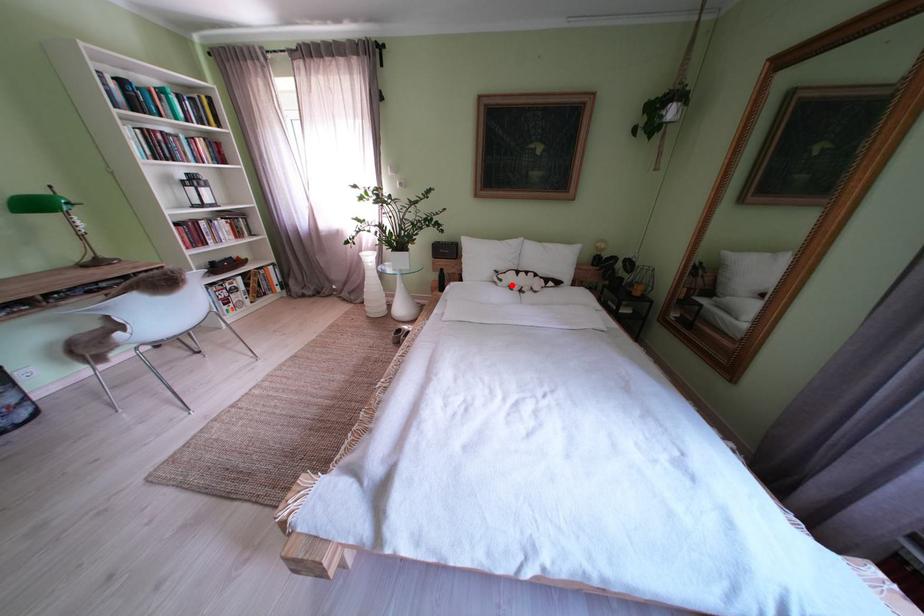
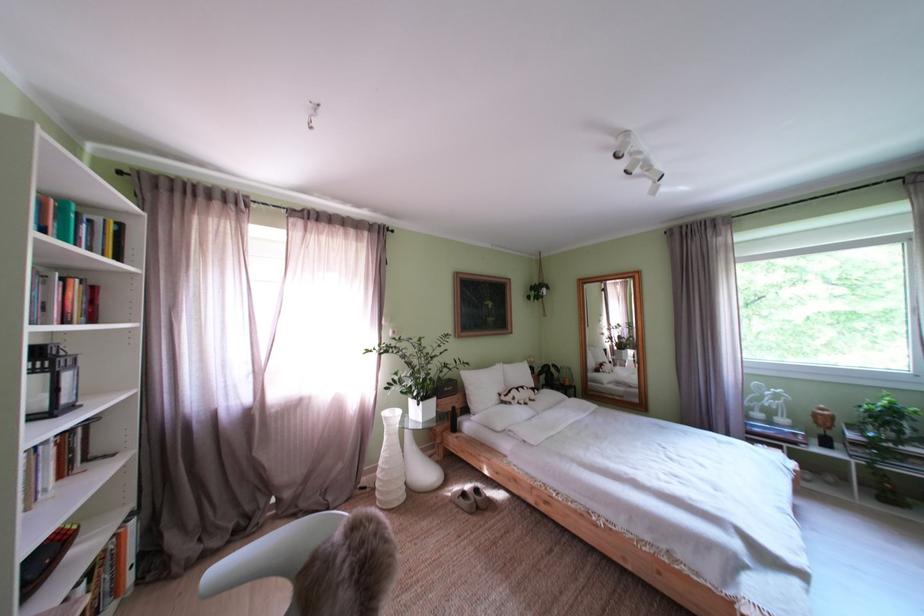
Question: I am providing you with two images of the same scene from different viewpoints. In image1, a red point is highlighted. Considering the same 3D point in image2, which of the following is correct?

Choices:
 (A) It is closer
 (B) It is farther

Answer: (B)